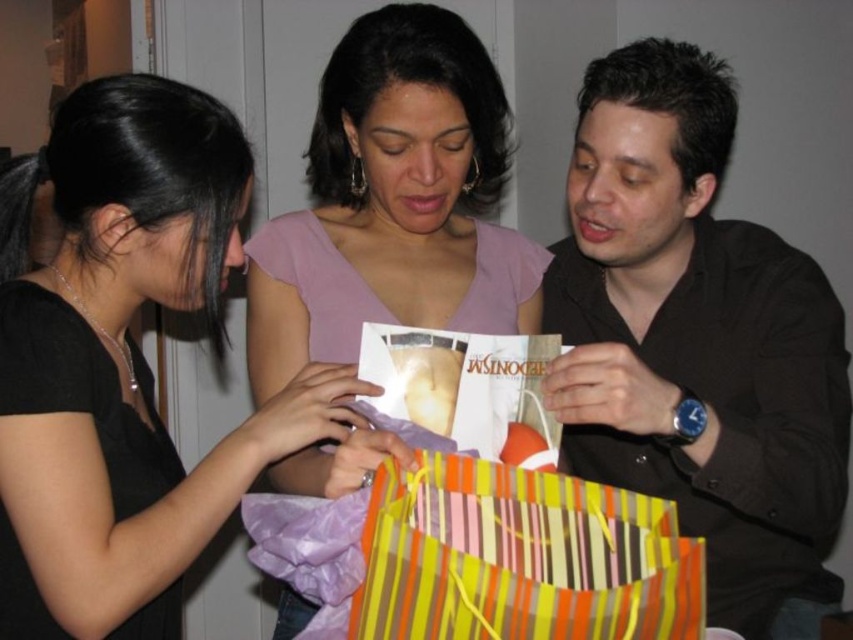
Between point (717, 419) and point (189, 129), which one is positioned behind?

Positioned behind is point (717, 419).

Is black matte shirt at right wider than matte purple blouse at center?

Correct, the width of black matte shirt at right exceeds that of matte purple blouse at center.

Locate an element on the screen. The image size is (853, 640). black matte shirt at right is located at coordinates (697, 342).

Does black matte shirt at right have a lesser height compared to pink fabric shirt at center?

Yes, black matte shirt at right is shorter than pink fabric shirt at center.

You are a GUI agent. You are given a task and a screenshot of the screen. Output one action in this format:
    pyautogui.click(x=<x>, y=<y>)
    Task: Click on the black matte shirt at right
    This screenshot has width=853, height=640.
    Given the screenshot: What is the action you would take?
    pyautogui.click(x=697, y=342)

This screenshot has width=853, height=640. In order to click on black matte shirt at right in this screenshot , I will do `click(697, 342)`.

Between point (409, 164) and point (627, 584), which one is positioned in front?

Point (627, 584) is in front.

Does pink fabric shirt at center appear under striped paper gift bag at lower center?

Incorrect, pink fabric shirt at center is not positioned below striped paper gift bag at lower center.

Is point (306, 269) farther from viewer compared to point (474, 552)?

Yes, it is.

Where is `pink fabric shirt at center`? This screenshot has height=640, width=853. pink fabric shirt at center is located at coordinates (393, 202).